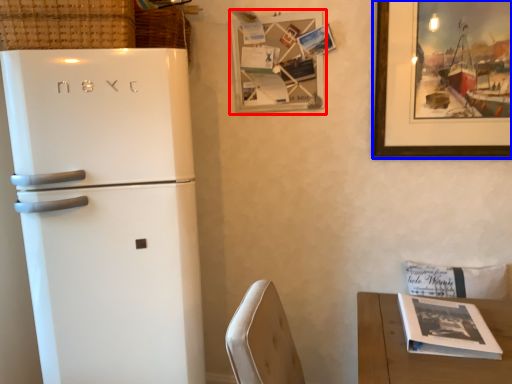
Question: Which of the following is the closest to the observer, picture frame (highlighted by a red box) or picture frame (highlighted by a blue box)?

Choices:
 (A) picture frame
 (B) picture frame

Answer: (B)